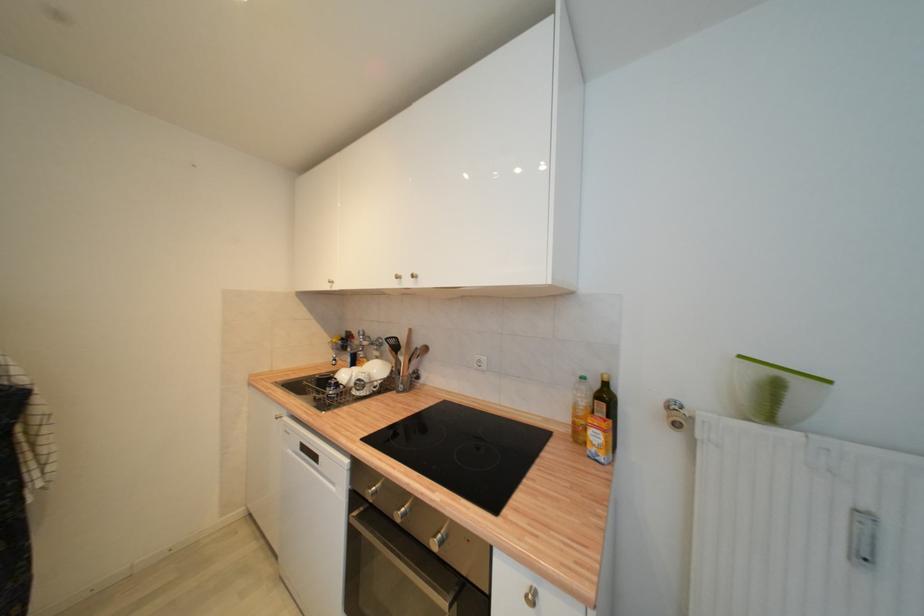
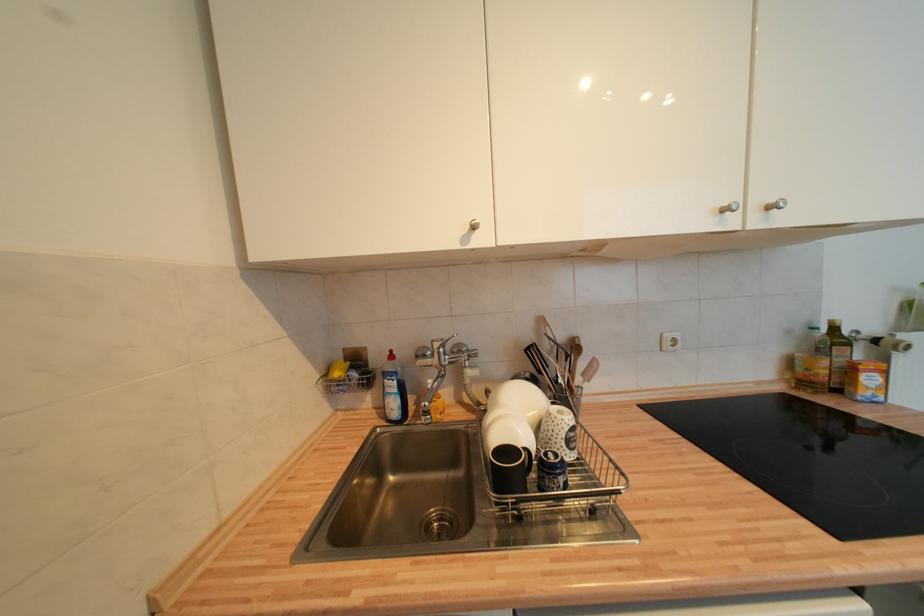
Find the pixel in the second image that matches (x=586, y=379) in the first image.

(819, 331)